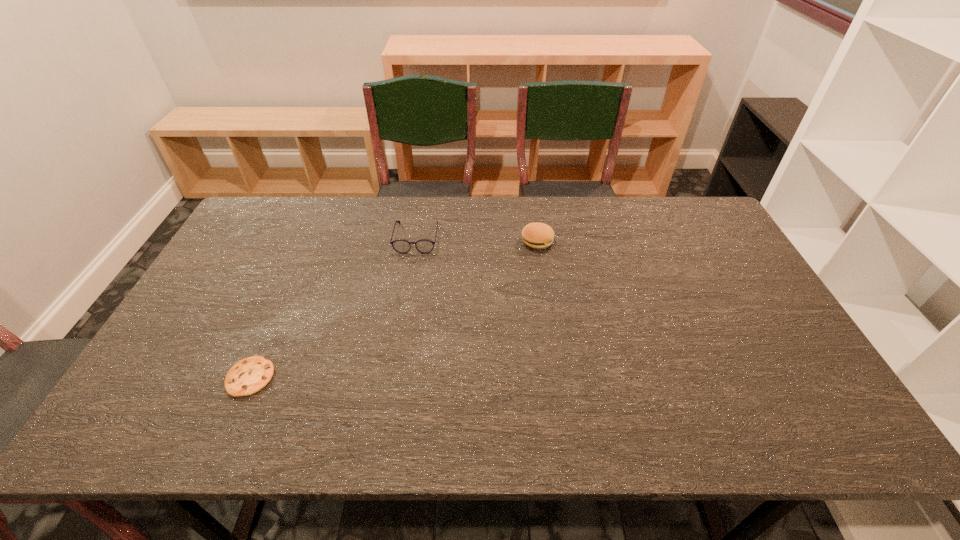
Where is `free space that is in between the cookie and the second object from left to right`? free space that is in between the cookie and the second object from left to right is located at coordinates [x=333, y=307].

You are a GUI agent. You are given a task and a screenshot of the screen. Output one action in this format:
    pyautogui.click(x=<x>, y=<y>)
    Task: Click on the empty space that is in between the leftmost object and the patty
    
    Given the screenshot: What is the action you would take?
    [x=394, y=309]

Where is `free area in between the spectacles and the patty`? The height and width of the screenshot is (540, 960). free area in between the spectacles and the patty is located at coordinates (477, 239).

Where is `blank region between the spectacles and the rightmost object`? The image size is (960, 540). blank region between the spectacles and the rightmost object is located at coordinates (477, 239).

The image size is (960, 540). Identify the location of vacant region between the rightmost object and the cookie. (394, 309).

This screenshot has width=960, height=540. I want to click on the closest object relative to the second object from right to left, so click(x=536, y=235).

Identify which object is located as the second nearest to the rightmost object. Please provide its 2D coordinates. Your answer should be formatted as a tuple, i.e. [(x, y)], where the tuple contains the x and y coordinates of a point satisfying the conditions above.

[(248, 376)]

Where is `vacant space that satisfies the following two spatial constraints: 1. on the front-facing side of the second object from right to left; 2. on the left side of the rightmost object`? The width and height of the screenshot is (960, 540). vacant space that satisfies the following two spatial constraints: 1. on the front-facing side of the second object from right to left; 2. on the left side of the rightmost object is located at coordinates (416, 241).

Identify the location of blank area in the image that satisfies the following two spatial constraints: 1. on the front-facing side of the second object from right to left; 2. on the left side of the patty. (416, 241).

I want to click on free location that satisfies the following two spatial constraints: 1. on the front-facing side of the spectacles; 2. on the left side of the rightmost object, so click(x=416, y=241).